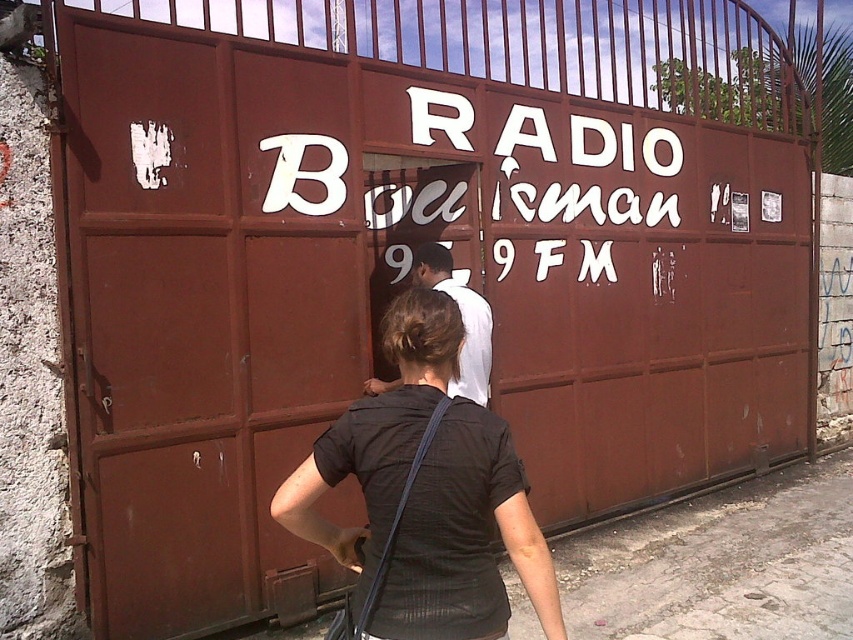
You are a security guard at the radio station. You notice two people near the gate. The person in the black matte shirt at center is approaching the gate, and the person in the white cloth shirt at center is inside. Which person is closer to the gate based on their clothing size?

The black matte shirt at center is smaller than the white cloth shirt at center, so the person wearing the black matte shirt at center is closer to the gate since smaller clothing size typically indicates proximity.